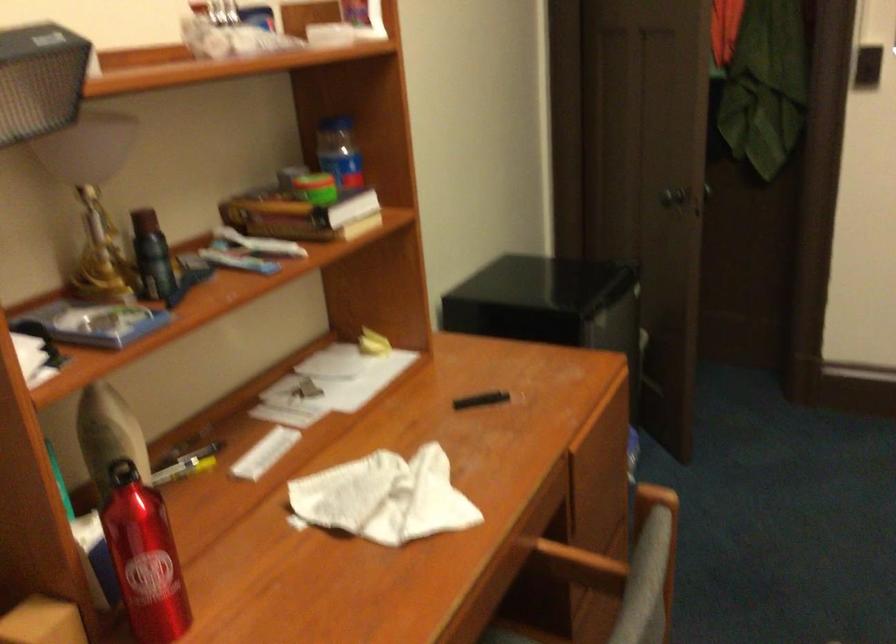
The width and height of the screenshot is (896, 644). Identify the location of light switch. (867, 66).